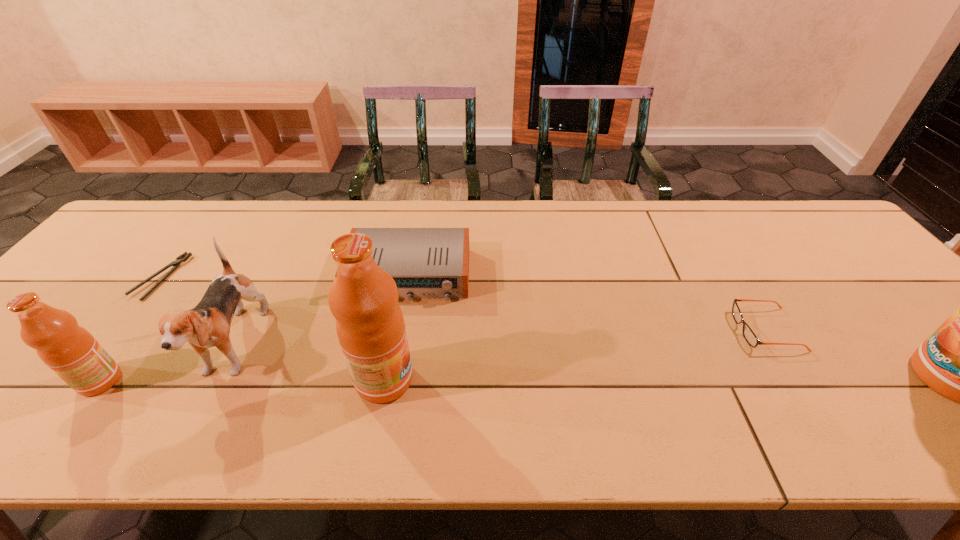
You are a GUI agent. You are given a task and a screenshot of the screen. Output one action in this format:
    pyautogui.click(x=<x>, y=<y>)
    Task: Click on the object that is the fifth closest to the fifth object from right to left
    The width and height of the screenshot is (960, 540).
    Given the screenshot: What is the action you would take?
    pyautogui.click(x=750, y=337)

At what (x,y) coordinates should I click in order to perform the action: click on fruit juice that can be found as the second closest to the rightmost fruit juice. Please return your answer as a coordinate pair (x, y). Looking at the image, I should click on (68, 349).

At what (x,y) coordinates should I click in order to perform the action: click on the closest fruit juice to the shortest fruit juice. Please return your answer as a coordinate pair (x, y). Looking at the image, I should click on (363, 298).